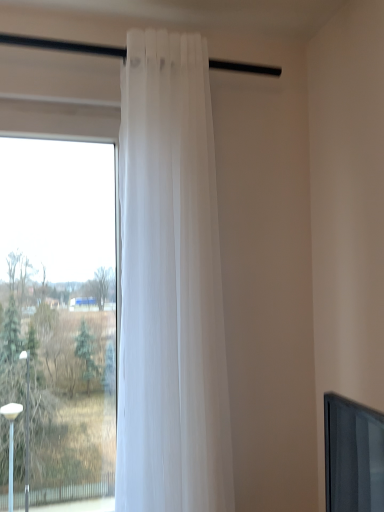
What do you see at coordinates (170, 285) in the screenshot? The height and width of the screenshot is (512, 384). I see `white sheer curtain at center` at bounding box center [170, 285].

The height and width of the screenshot is (512, 384). What are the coordinates of `white sheer curtain at center` in the screenshot? It's located at (170, 285).

The width and height of the screenshot is (384, 512). In order to click on white sheer curtain at center in this screenshot , I will do `click(170, 285)`.